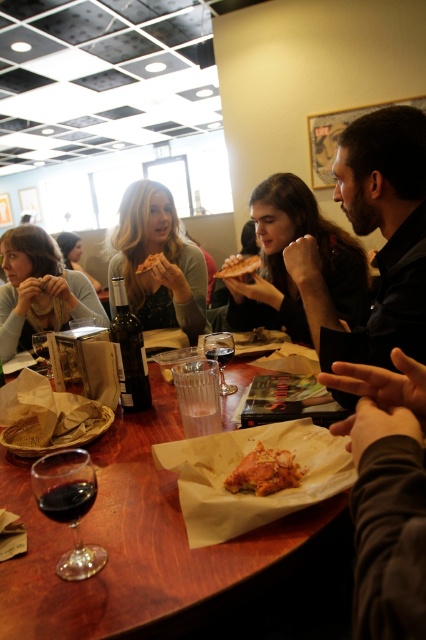
Question: Which object appears closest to the camera in this image?

Choices:
 (A) dark brown leather jacket at center
 (B) dark brown leather jacket at upper right
 (C) golden crispy pizza at center
 (D) matte black pizza at upper left

Answer: (B)

Question: Is matte beige napkin at upper left above golden crispy pizza at center?

Choices:
 (A) no
 (B) yes

Answer: (A)

Question: Can you confirm if dark brown leather jacket at center is wider than golden crispy chicken at center?

Choices:
 (A) yes
 (B) no

Answer: (A)

Question: Is dark brown leather jacket at upper right below golden crispy pizza slice at center?

Choices:
 (A) no
 (B) yes

Answer: (B)

Question: Which object is closer to the camera taking this photo?

Choices:
 (A) matte beige napkin at upper left
 (B) golden crispy pizza slice at center
 (C) blonde hair at upper left

Answer: (B)

Question: Which is farther from the dark gray fabric hand at lower right?

Choices:
 (A) dark brown leather jacket at upper right
 (B) matte black pizza at upper left
 (C) golden crispy pizza slice at center
 (D) golden crispy pizza at center

Answer: (B)